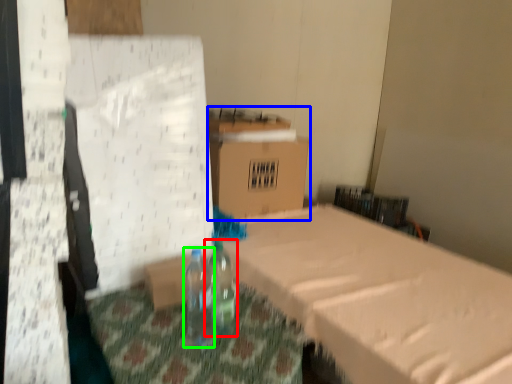
Question: Estimate the real-world distances between objects in this image. Which object is closer to bottle (highlighted by a red box), cardboard box (highlighted by a blue box) or bottle (highlighted by a green box)?

Choices:
 (A) cardboard box
 (B) bottle

Answer: (B)